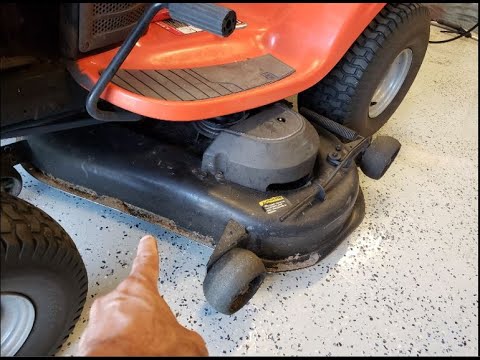
Image resolution: width=480 pixels, height=360 pixels. I want to click on handle, so (190, 9).